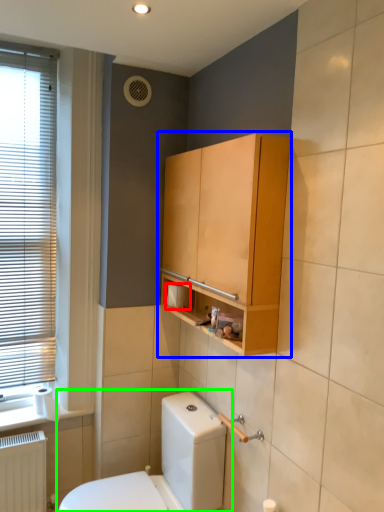
Question: Based on their relative distances, which object is nearer to toilet paper (highlighted by a red box)? Choose from bathroom cabinet (highlighted by a blue box) and toilet (highlighted by a green box).

Choices:
 (A) bathroom cabinet
 (B) toilet

Answer: (A)